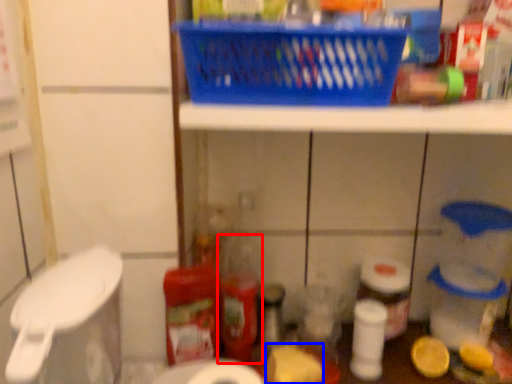
Question: Which object appears closest to the camera in this image, bottle (highlighted by a red box) or food (highlighted by a blue box)?

Choices:
 (A) bottle
 (B) food

Answer: (B)